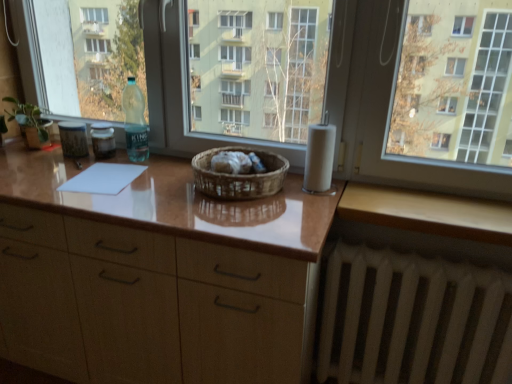
The height and width of the screenshot is (384, 512). What are the coordinates of `vacant space situated above matte brown countertop at center (from a real-world perspective)` in the screenshot? It's located at (147, 182).